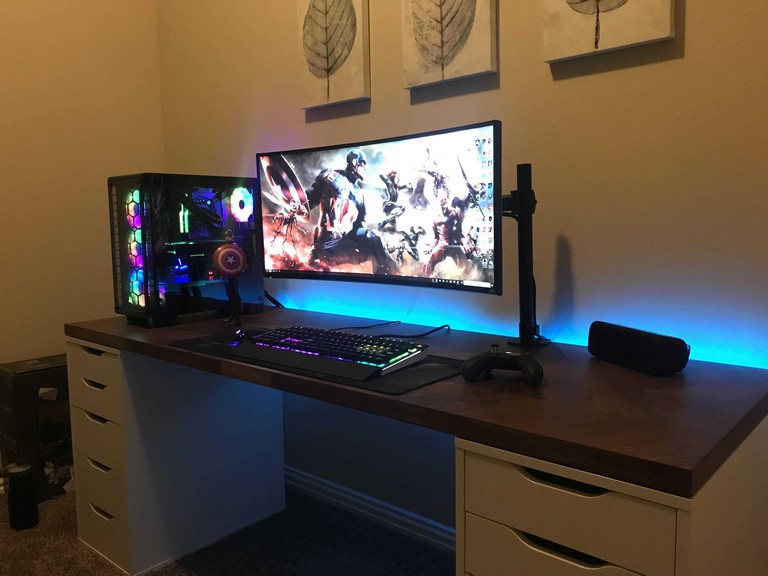
Where is `large screen`? large screen is located at coordinates (428, 159).